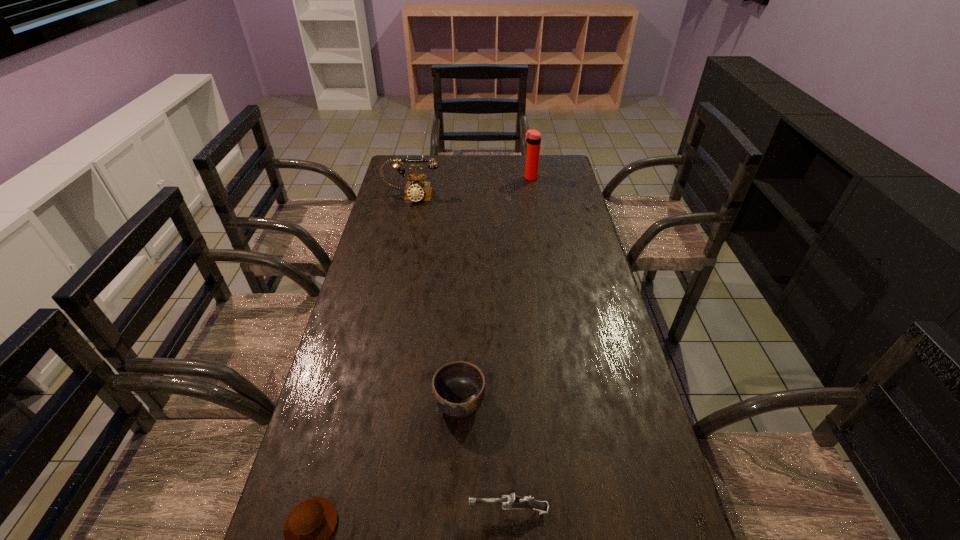
Locate an element on the screen. The image size is (960, 540). free region at the far right corner of the desktop is located at coordinates (546, 163).

Locate an element on the screen. The width and height of the screenshot is (960, 540). unoccupied area between the third shortest object and the second farthest object is located at coordinates (436, 300).

Locate an element on the screen. free point between the gun and the tallest object is located at coordinates (519, 344).

In order to click on free spot between the third shortest object and the fourth shortest object in this screenshot , I will do `click(436, 300)`.

Find the location of a particular element. free space between the gun and the rightmost object is located at coordinates (519, 344).

Locate an element on the screen. This screenshot has height=540, width=960. free space between the gun and the third nearest object is located at coordinates (484, 456).

You are a GUI agent. You are given a task and a screenshot of the screen. Output one action in this format:
    pyautogui.click(x=<x>, y=<y>)
    Task: Click on the object that can be found as the second closest to the telephone
    The width and height of the screenshot is (960, 540).
    Given the screenshot: What is the action you would take?
    pyautogui.click(x=458, y=388)

Locate an element on the screen. This screenshot has height=540, width=960. object that is the closest to the rightmost object is located at coordinates tap(416, 190).

Image resolution: width=960 pixels, height=540 pixels. In order to click on vacant point that satisfies the following two spatial constraints: 1. on the dial number of the bowl; 2. on the left side of the telephone in this screenshot , I will do `click(367, 403)`.

You are a GUI agent. You are given a task and a screenshot of the screen. Output one action in this format:
    pyautogui.click(x=<x>, y=<y>)
    Task: Click on the vacant point that satisfies the following two spatial constraints: 1. on the dial number of the third nearest object; 2. on the right side of the fourth nearest object
    
    Given the screenshot: What is the action you would take?
    pyautogui.click(x=367, y=403)